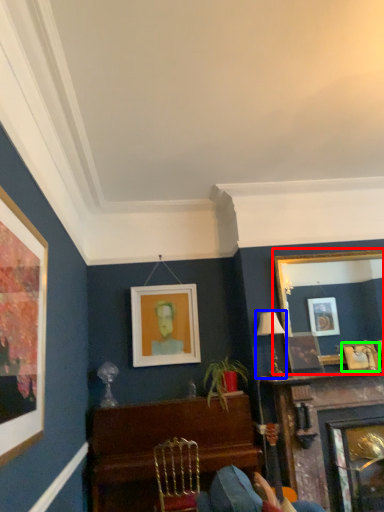
Question: Which object is positioned closest to picture frame (highlighted by a red box)? Select from lamp (highlighted by a blue box) and picture frame (highlighted by a green box).

Choices:
 (A) lamp
 (B) picture frame

Answer: (B)